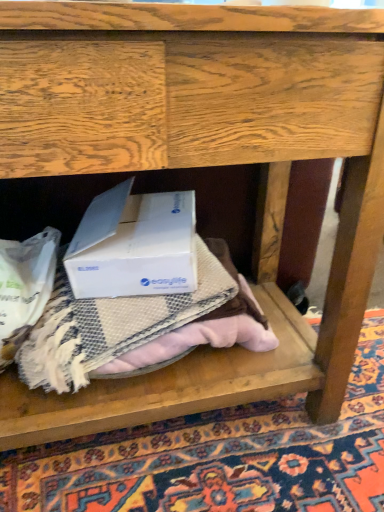
Question: Based on their sizes in the image, would you say beige textured blanket at center is bigger or smaller than beige textured mat at center?

Choices:
 (A) small
 (B) big

Answer: (A)

Question: Is point (241, 334) positioned closer to the camera than point (271, 484)?

Choices:
 (A) farther
 (B) closer

Answer: (A)

Question: Which of these objects is positioned closest to the white cardboard box at center?

Choices:
 (A) beige textured mat at center
 (B) beige textured blanket at center

Answer: (B)

Question: Which object is the closest to the beige textured blanket at center?

Choices:
 (A) white cardboard box at center
 (B) beige textured mat at center

Answer: (A)